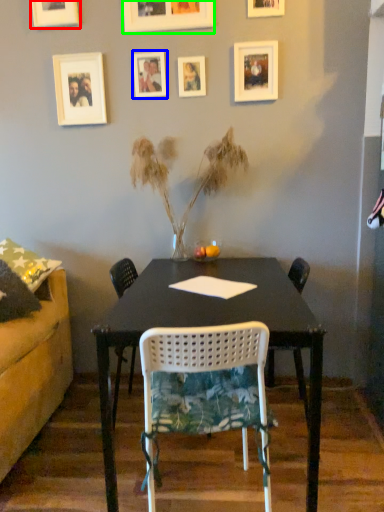
Question: Based on their relative distances, which object is nearer to picture frame (highlighted by a red box)? Choose from picture frame (highlighted by a blue box) and picture frame (highlighted by a green box).

Choices:
 (A) picture frame
 (B) picture frame

Answer: (B)